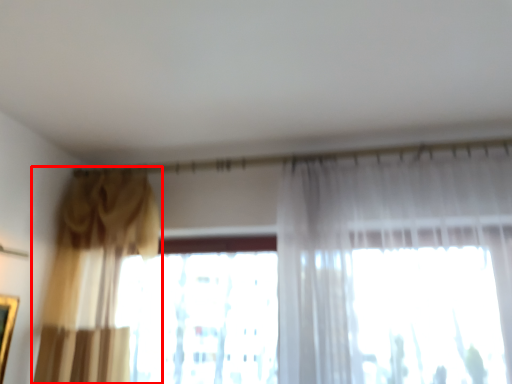
Question: From the image's perspective, what is the correct spatial relationship of curtain (annotated by the red box) in relation to window?

Choices:
 (A) below
 (B) above

Answer: (B)